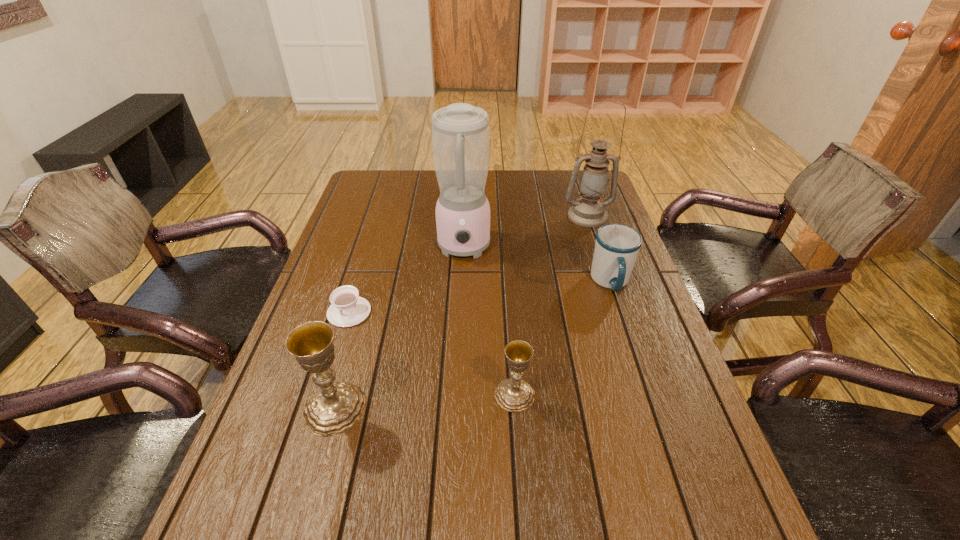
In the image, there is a desktop. Identify the location of vacant space at the left edge. The width and height of the screenshot is (960, 540). (300, 442).

The width and height of the screenshot is (960, 540). I want to click on vacant position at the right edge of the desktop, so (x=626, y=350).

Where is `vacant region at the far left corner`? vacant region at the far left corner is located at coordinates (369, 173).

Where is `blank space at the near left corner of the desktop`? Image resolution: width=960 pixels, height=540 pixels. blank space at the near left corner of the desktop is located at coordinates (295, 459).

Find the location of a particular element. blank region between the teacup and the shorter chalice is located at coordinates (432, 354).

Find the location of a particular element. This screenshot has height=540, width=960. empty space that is in between the oil lamp and the right chalice is located at coordinates (551, 306).

Find the location of a particular element. free area in between the third object from right to left and the left chalice is located at coordinates (424, 402).

Locate an element on the screen. The width and height of the screenshot is (960, 540). free space between the third object from right to left and the mug is located at coordinates (563, 339).

Locate an element on the screen. blank region between the third object from right to left and the shortest object is located at coordinates (432, 354).

The width and height of the screenshot is (960, 540). I want to click on vacant area that lies between the mug and the fourth object from left to right, so click(x=563, y=339).